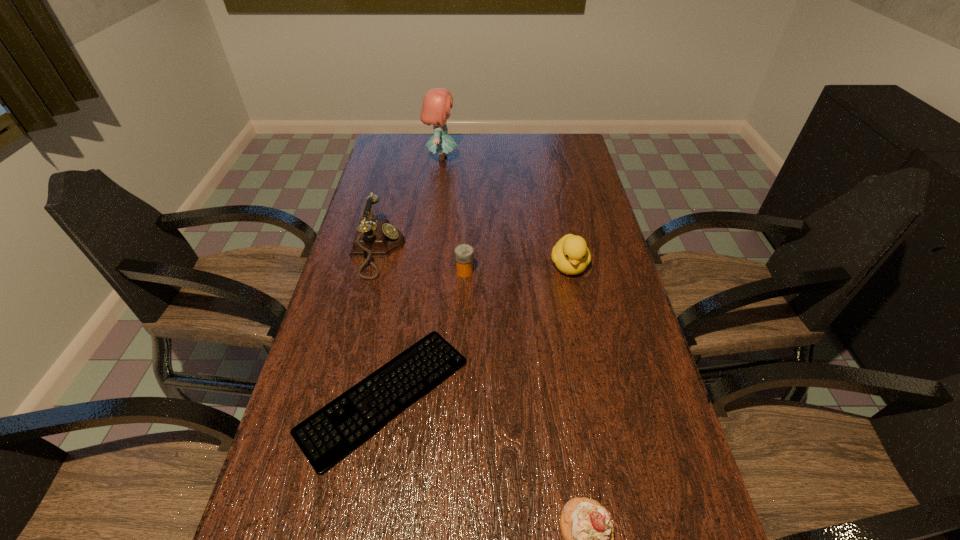
Where is `empty space that is in between the fifth tallest object and the duck`? empty space that is in between the fifth tallest object and the duck is located at coordinates (516, 269).

You are a GUI agent. You are given a task and a screenshot of the screen. Output one action in this format:
    pyautogui.click(x=<x>, y=<y>)
    Task: Click on the vacant region between the second shortest object and the duck
    This screenshot has height=540, width=960.
    Given the screenshot: What is the action you would take?
    pyautogui.click(x=516, y=269)

Find the location of a particular element. This screenshot has height=540, width=960. free area in between the tallest object and the second shortest object is located at coordinates (453, 215).

You are a GUI agent. You are given a task and a screenshot of the screen. Output one action in this format:
    pyautogui.click(x=<x>, y=<y>)
    Task: Click on the blank region between the doll and the telephone
    This screenshot has width=960, height=540.
    Given the screenshot: What is the action you would take?
    pyautogui.click(x=410, y=205)

Locate an element on the screen. The height and width of the screenshot is (540, 960). unoccupied position between the duck and the computer keyboard is located at coordinates (477, 331).

Identify the location of free space between the tallest object and the second shortest object. The height and width of the screenshot is (540, 960). (453, 215).

I want to click on the second closest object to the cupcake, so click(571, 256).

At what (x,y) coordinates should I click in order to perform the action: click on object that can be found as the fifth closest to the computer keyboard. Please return your answer as a coordinate pair (x, y). This screenshot has height=540, width=960. Looking at the image, I should click on (436, 106).

I want to click on vacant region that satisfies the following two spatial constraints: 1. on the dial of the telephone; 2. on the right side of the fifth farthest object, so click(343, 396).

The height and width of the screenshot is (540, 960). In order to click on vacant point that satisfies the following two spatial constraints: 1. on the label side of the medicine; 2. on the front side of the shortest object in this screenshot , I will do `click(461, 396)`.